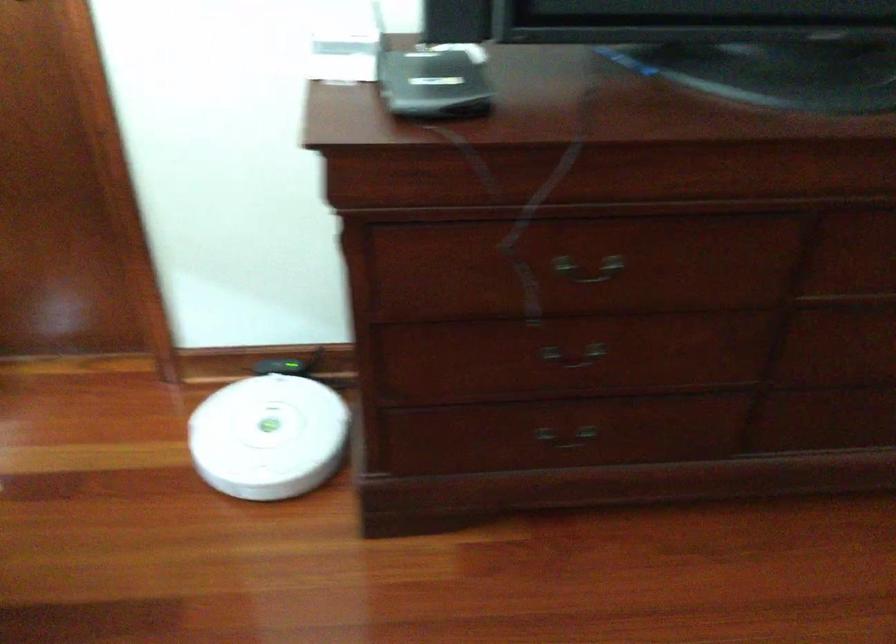
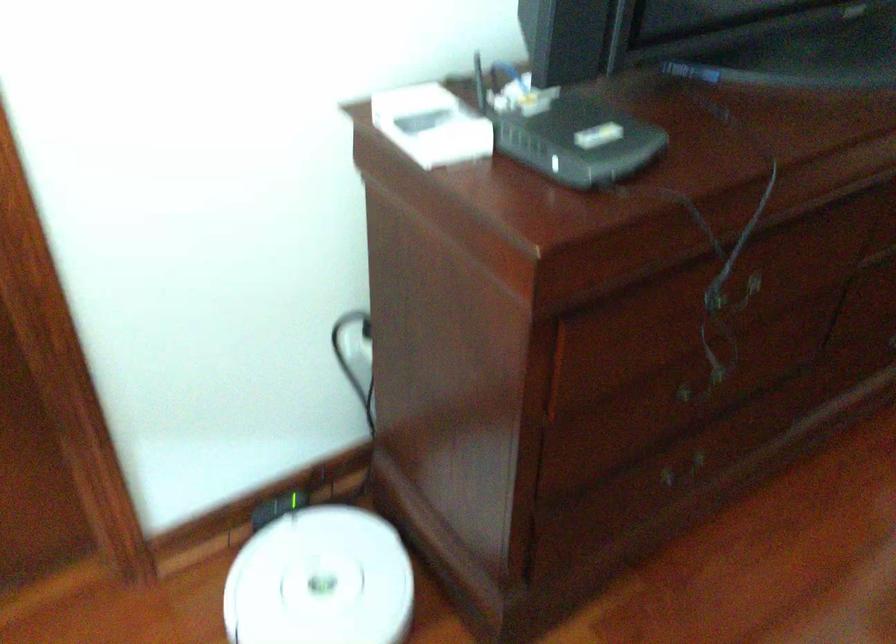
Question: The camera is either moving clockwise (left) or counter-clockwise (right) around the object. The first image is from the beginning of the video and the second image is from the end. Is the camera moving left or right when shooting the video?

Choices:
 (A) Left
 (B) Right

Answer: (A)